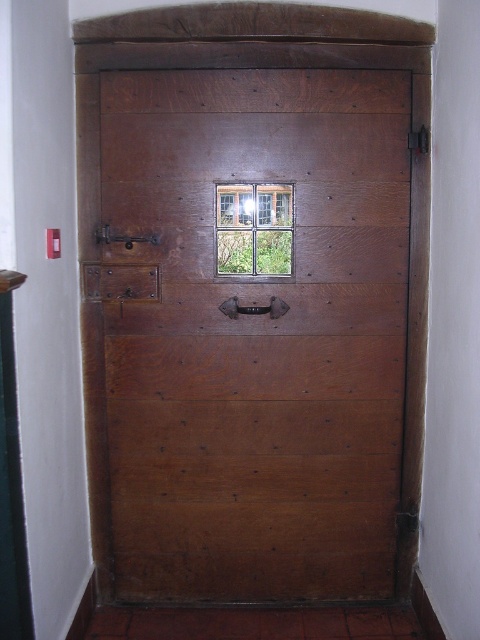
Question: Among these objects, which one is nearest to the camera?

Choices:
 (A) matte wood door at center
 (B) wooden textured window at center

Answer: (A)

Question: Observing the image, what is the correct spatial positioning of matte wood door at center in reference to wooden textured window at center?

Choices:
 (A) below
 (B) above

Answer: (A)

Question: Which of the following is the closest to the observer?

Choices:
 (A) (109, 170)
 (B) (271, 234)

Answer: (A)

Question: Does matte wood door at center appear on the left side of wooden textured window at center?

Choices:
 (A) no
 (B) yes

Answer: (B)

Question: Does matte wood door at center have a greater width compared to wooden textured window at center?

Choices:
 (A) yes
 (B) no

Answer: (A)